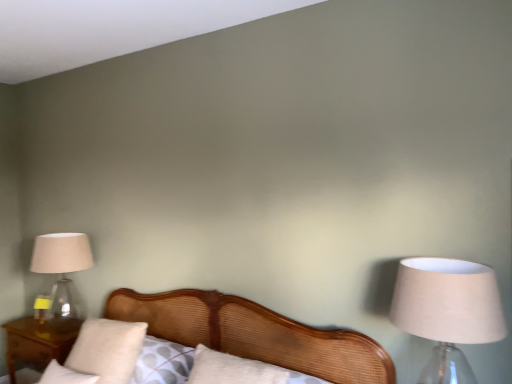
How much space does white soft pillow at lower left, marked as the first pillow in a bottom-to-top arrangement, occupy horizontally?

19.29 centimeters.

I want to click on beige fabric lampshade at right, the second lamp when ordered from back to front, so click(447, 311).

Describe the element at coordinates (34, 345) in the screenshot. I see `wooden nightstand at lower left` at that location.

Where is `wooden bed at center`? The image size is (512, 384). wooden bed at center is located at coordinates (255, 334).

What are the coordinates of `clear glass lampshade at left, placed as the 2th lamp when sorted from right to left` in the screenshot? It's located at (62, 273).

Based on their positions, is beige fabric lampshade at right, acting as the 1th lamp starting from the right, located to the left or right of white soft pillow at lower left, marked as the first pillow in a bottom-to-top arrangement?

From the image, it's evident that beige fabric lampshade at right, acting as the 1th lamp starting from the right, is to the right of white soft pillow at lower left, marked as the first pillow in a bottom-to-top arrangement.

From the image's perspective, is beige fabric lampshade at right, acting as the 1th lamp starting from the right, beneath white soft pillow at lower left, marked as the first pillow in a bottom-to-top arrangement?

No, from the image's perspective, beige fabric lampshade at right, acting as the 1th lamp starting from the right, is not beneath white soft pillow at lower left, marked as the first pillow in a bottom-to-top arrangement.

Do you think beige fabric lampshade at right, positioned as the second lamp in left-to-right order, is within white soft pillow at lower left, which ranks as the second pillow in top-to-bottom order, or outside of it?

beige fabric lampshade at right, positioned as the second lamp in left-to-right order, is outside white soft pillow at lower left, which ranks as the second pillow in top-to-bottom order.

From a real-world perspective, is beige fabric lampshade at right, the second lamp when ordered from back to front, physically above white soft pillow at lower left, marked as the first pillow in a bottom-to-top arrangement?

Yes, from a real-world perspective, beige fabric lampshade at right, the second lamp when ordered from back to front, is above white soft pillow at lower left, marked as the first pillow in a bottom-to-top arrangement.

Consider the image. From a real-world perspective, who is located higher, clear glass lampshade at left, the second lamp viewed from the front, or beige fabric lampshade at right, positioned as the second lamp in left-to-right order?

beige fabric lampshade at right, positioned as the second lamp in left-to-right order, from a real-world perspective.

Based on the photo, is clear glass lampshade at left, the second lamp viewed from the front, taller or shorter than beige fabric lampshade at right, acting as the 1th lamp starting from the right?

clear glass lampshade at left, the second lamp viewed from the front, is taller than beige fabric lampshade at right, acting as the 1th lamp starting from the right.

From the picture: Is clear glass lampshade at left, positioned as the first lamp in left-to-right order, bigger or smaller than beige fabric lampshade at right, acting as the 1th lamp starting from the right?

In the image, clear glass lampshade at left, positioned as the first lamp in left-to-right order, appears to be larger than beige fabric lampshade at right, acting as the 1th lamp starting from the right.

Is beige fabric lampshade at right, the 1th lamp when ordered from front to back, inside clear glass lampshade at left, positioned as the first lamp in left-to-right order?

Actually, beige fabric lampshade at right, the 1th lamp when ordered from front to back, is outside clear glass lampshade at left, positioned as the first lamp in left-to-right order.

Is white soft pillow at lower left, which is the second pillow in bottom-to-top order, not near beige fabric lampshade at right, positioned as the second lamp in left-to-right order?

Yes.

Find the location of a particular element. the 1st pillow below the beige fabric lampshade at right, the 1th lamp when ordered from front to back (from a real-world perspective) is located at coordinates (106, 349).

Is wooden bed at center further to the viewer compared to white soft pillow at lower left, which is the second pillow in bottom-to-top order?

No, it is not.

Is white soft pillow at lower left, the first pillow positioned from the top, inside wooden bed at center?

Yes, white soft pillow at lower left, the first pillow positioned from the top, is inside wooden bed at center.

Can you see wooden bed at center touching white soft pillow at lower left, the first pillow positioned from the top?

No, wooden bed at center is not touching white soft pillow at lower left, the first pillow positioned from the top.

From the image's perspective, is white soft pillow at lower left, which ranks as the second pillow in top-to-bottom order, beneath wooden nightstand at lower left?

No, from the image's perspective, white soft pillow at lower left, which ranks as the second pillow in top-to-bottom order, is not beneath wooden nightstand at lower left.

Is white soft pillow at lower left, which ranks as the second pillow in top-to-bottom order, next to wooden nightstand at lower left?

There is a gap between white soft pillow at lower left, which ranks as the second pillow in top-to-bottom order, and wooden nightstand at lower left.

From the wooden nightstand at lower left, count 1st pillow to the right and point to it. Please provide its 2D coordinates.

[(65, 375)]

Can you confirm if white soft pillow at lower left, which ranks as the second pillow in top-to-bottom order, is taller than wooden nightstand at lower left?

In fact, white soft pillow at lower left, which ranks as the second pillow in top-to-bottom order, may be shorter than wooden nightstand at lower left.

From the picture: From a real-world perspective, is white soft pillow at lower left, marked as the first pillow in a bottom-to-top arrangement, beneath wooden bed at center?

Actually, white soft pillow at lower left, marked as the first pillow in a bottom-to-top arrangement, is physically above wooden bed at center in the real world.

At what (x,y) coordinates should I click in order to perform the action: click on bed on the right of the white soft pillow at lower left, which ranks as the second pillow in top-to-bottom order. Please return your answer as a coordinate pair (x, y). The width and height of the screenshot is (512, 384). Looking at the image, I should click on [255, 334].

Considering the points (50, 367) and (288, 344), which point is behind, point (50, 367) or point (288, 344)?

The point (50, 367) is farther.

Is white soft pillow at lower left, which ranks as the second pillow in top-to-bottom order, bigger than wooden bed at center?

Actually, white soft pillow at lower left, which ranks as the second pillow in top-to-bottom order, might be smaller than wooden bed at center.

Considering the sizes of clear glass lampshade at left, placed as the 2th lamp when sorted from right to left, and white soft pillow at lower left, the first pillow positioned from the top, in the image, is clear glass lampshade at left, placed as the 2th lamp when sorted from right to left, bigger or smaller than white soft pillow at lower left, the first pillow positioned from the top,?

Clearly, clear glass lampshade at left, placed as the 2th lamp when sorted from right to left, is larger in size than white soft pillow at lower left, the first pillow positioned from the top.

From the image's perspective, between clear glass lampshade at left, placed as the 2th lamp when sorted from right to left, and white soft pillow at lower left, which is the second pillow in bottom-to-top order, which one is located above?

clear glass lampshade at left, placed as the 2th lamp when sorted from right to left, appears higher in the image.

Is clear glass lampshade at left, placed as the 2th lamp when sorted from right to left, inside the boundaries of white soft pillow at lower left, which is the second pillow in bottom-to-top order, or outside?

clear glass lampshade at left, placed as the 2th lamp when sorted from right to left, is not inside white soft pillow at lower left, which is the second pillow in bottom-to-top order, it's outside.

Is clear glass lampshade at left, the first lamp from the back, at the right side of white soft pillow at lower left, the first pillow positioned from the top?

No.

From a real-world perspective, which lamp is the 2nd one above the white soft pillow at lower left, marked as the first pillow in a bottom-to-top arrangement? Please provide its 2D coordinates.

[(447, 311)]

You are a GUI agent. You are given a task and a screenshot of the screen. Output one action in this format:
    pyautogui.click(x=<x>, y=<y>)
    Task: Click on the lamp on the left of beige fabric lampshade at right, acting as the 1th lamp starting from the right
    The width and height of the screenshot is (512, 384).
    Given the screenshot: What is the action you would take?
    pyautogui.click(x=62, y=273)

From the image, which object appears to be farther from wooden bed at center, clear glass lampshade at left, the second lamp viewed from the front, or white soft pillow at lower left, the first pillow positioned from the top?

clear glass lampshade at left, the second lamp viewed from the front, lies further to wooden bed at center than the other object.

When comparing their distances from white soft pillow at lower left, which ranks as the second pillow in top-to-bottom order, does wooden nightstand at lower left or clear glass lampshade at left, placed as the 2th lamp when sorted from right to left, seem closer?

Among the two, wooden nightstand at lower left is located nearer to white soft pillow at lower left, which ranks as the second pillow in top-to-bottom order.

Estimate the real-world distances between objects in this image. Which object is further from white soft pillow at lower left, which is the second pillow in bottom-to-top order, beige fabric lampshade at right, the 1th lamp when ordered from front to back, or wooden bed at center?

Among the two, beige fabric lampshade at right, the 1th lamp when ordered from front to back, is located further to white soft pillow at lower left, which is the second pillow in bottom-to-top order.

Estimate the real-world distances between objects in this image. Which object is further from wooden nightstand at lower left, clear glass lampshade at left, positioned as the first lamp in left-to-right order, or wooden bed at center?

wooden bed at center is further to wooden nightstand at lower left.

From the image, which object appears to be farther from white soft pillow at lower left, the first pillow positioned from the top, wooden bed at center or beige fabric lampshade at right, acting as the 1th lamp starting from the right?

beige fabric lampshade at right, acting as the 1th lamp starting from the right.

Looking at the image, which one is located further to clear glass lampshade at left, the second lamp viewed from the front, wooden nightstand at lower left or white soft pillow at lower left, which ranks as the second pillow in top-to-bottom order?

white soft pillow at lower left, which ranks as the second pillow in top-to-bottom order, is positioned further to the anchor clear glass lampshade at left, the second lamp viewed from the front.

From the image, which object appears to be farther from white soft pillow at lower left, the first pillow positioned from the top, wooden nightstand at lower left or beige fabric lampshade at right, acting as the 1th lamp starting from the right?

The object further to white soft pillow at lower left, the first pillow positioned from the top, is beige fabric lampshade at right, acting as the 1th lamp starting from the right.

Looking at the image, which one is located closer to white soft pillow at lower left, marked as the first pillow in a bottom-to-top arrangement, wooden nightstand at lower left or beige fabric lampshade at right, acting as the 1th lamp starting from the right?

Based on the image, wooden nightstand at lower left appears to be nearer to white soft pillow at lower left, marked as the first pillow in a bottom-to-top arrangement.

Locate an element on the screen. lamp between wooden nightstand at lower left and beige fabric lampshade at right, acting as the 1th lamp starting from the right is located at coordinates (62, 273).

Locate an element on the screen. pillow located between white soft pillow at lower left, marked as the first pillow in a bottom-to-top arrangement, and wooden nightstand at lower left in the depth direction is located at coordinates (106, 349).

The height and width of the screenshot is (384, 512). What are the coordinates of `pillow between wooden bed at center and white soft pillow at lower left, the first pillow positioned from the top, from front to back` in the screenshot? It's located at (65, 375).

Locate an element on the screen. Image resolution: width=512 pixels, height=384 pixels. bed between white soft pillow at lower left, the first pillow positioned from the top, and beige fabric lampshade at right, the second lamp when ordered from back to front is located at coordinates (255, 334).